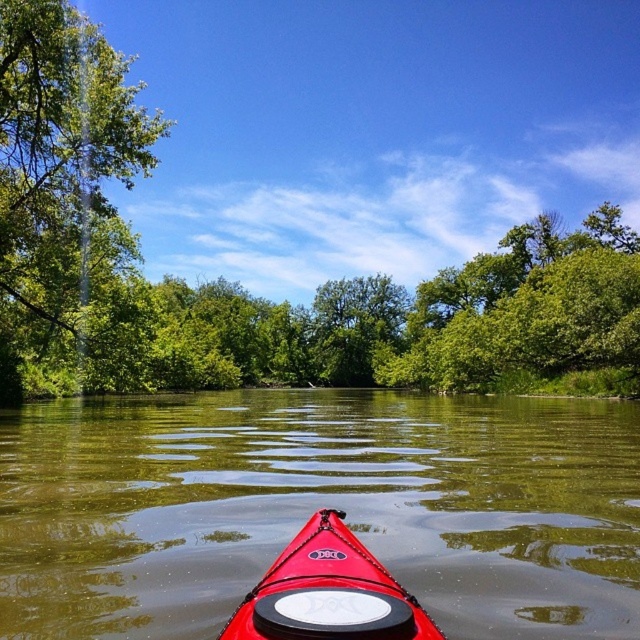
Does glossy red kayak at center have a smaller size compared to shiny red kayak at center?

No, glossy red kayak at center is not smaller than shiny red kayak at center.

Can you confirm if glossy red kayak at center is taller than shiny red kayak at center?

Indeed, glossy red kayak at center has a greater height compared to shiny red kayak at center.

Does point (74, 595) come closer to viewer compared to point (355, 540)?

No, (74, 595) is further to viewer.

In order to click on glossy red kayak at center in this screenshot , I will do `click(317, 508)`.

Does green leafy tree at center appear on the right side of shiny red kayak at center?

Result: Correct, you'll find green leafy tree at center to the right of shiny red kayak at center.

Does point (548, 390) come in front of point (280, 561)?

No, (548, 390) is further to viewer.

Who is more distant from viewer, (44,326) or (342,513)?

Positioned behind is point (44,326).

What are the coordinates of `green leafy tree at center` in the screenshot? It's located at (392, 323).

Between point (120, 362) and point (51, 97), which one is positioned in front?

Point (51, 97) is in front.

Locate an element on the screen. Image resolution: width=640 pixels, height=640 pixels. green leafy tree at center is located at coordinates (392, 323).